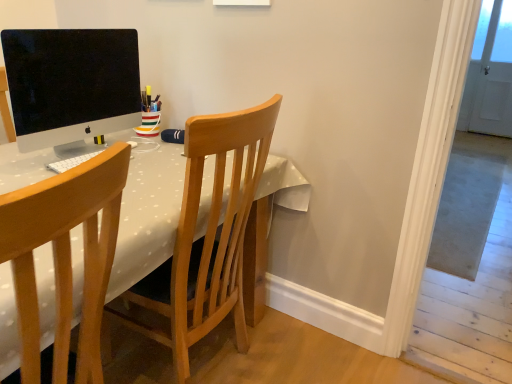
Question: Considering the positions of point (269, 167) and point (70, 160), is point (269, 167) closer or farther from the camera than point (70, 160)?

Choices:
 (A) farther
 (B) closer

Answer: (A)

Question: From a real-world perspective, is white dotted fabric table at center physically located above or below white matte keyboard at center?

Choices:
 (A) above
 (B) below

Answer: (B)

Question: Estimate the real-world distances between objects in this image. Which object is closer to the wooden chair at left, the first chair viewed from the front?

Choices:
 (A) matte black monitor at upper left
 (B) white matte keyboard at center
 (C) white dotted fabric table at center
 (D) wooden chair at center, which is the 1th chair in back-to-front order

Answer: (C)

Question: Which of these objects is positioned closest to the white matte keyboard at center?

Choices:
 (A) matte black monitor at upper left
 (B) wooden chair at left, the first chair viewed from the front
 (C) white dotted fabric table at center
 (D) wooden chair at center, marked as the 2th chair in a front-to-back arrangement

Answer: (C)